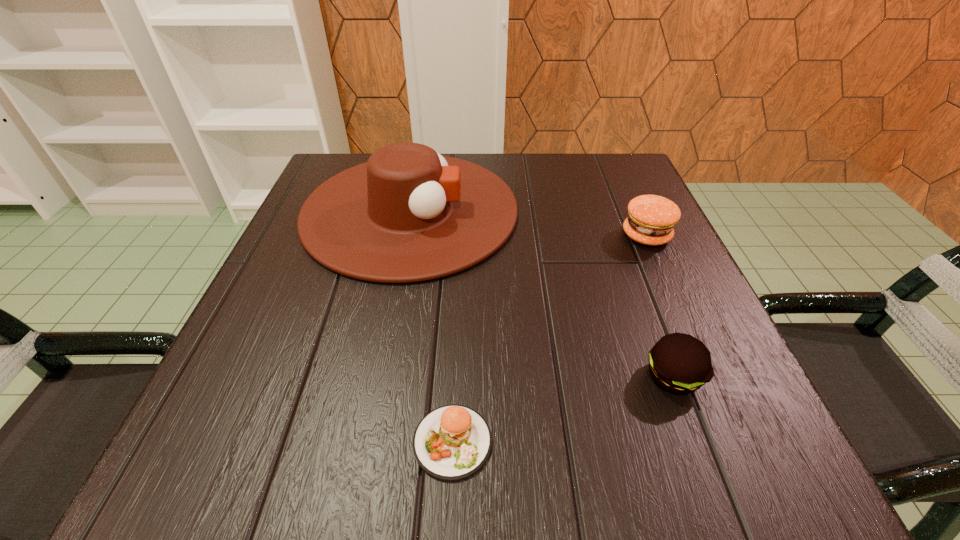
Where is `the tallest object`? The width and height of the screenshot is (960, 540). the tallest object is located at coordinates (409, 214).

Image resolution: width=960 pixels, height=540 pixels. Identify the location of the farthest patty. (651, 219).

The width and height of the screenshot is (960, 540). In order to click on the second farthest patty in this screenshot , I will do `click(679, 363)`.

Image resolution: width=960 pixels, height=540 pixels. I want to click on the nearest patty, so click(x=452, y=442).

The image size is (960, 540). What are the coordinates of `the shortest patty` in the screenshot? It's located at (452, 442).

At what (x,y) coordinates should I click in order to perform the action: click on vacant space located 0.050m on the front-facing side of the tallest object. Please return your answer as a coordinate pair (x, y). Looking at the image, I should click on (541, 211).

Where is `free space located on the front of the farthest patty`? The width and height of the screenshot is (960, 540). free space located on the front of the farthest patty is located at coordinates (702, 359).

Image resolution: width=960 pixels, height=540 pixels. What are the coordinates of `vacant space positioned on the back of the third farthest object` in the screenshot? It's located at (637, 284).

Where is `free spot located on the back of the shortest object`? free spot located on the back of the shortest object is located at coordinates (459, 304).

Identify the location of object that is at the far edge. (409, 214).